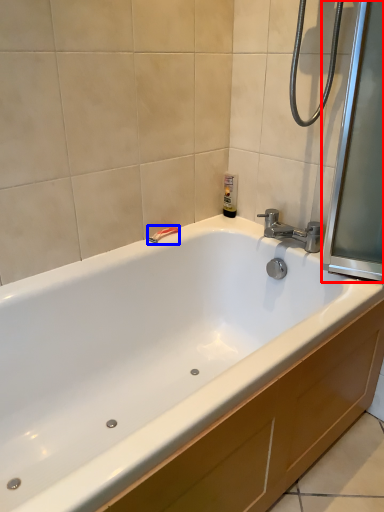
Question: Which object is further to the camera taking this photo, screen door (highlighted by a red box) or shower (highlighted by a blue box)?

Choices:
 (A) screen door
 (B) shower

Answer: (B)